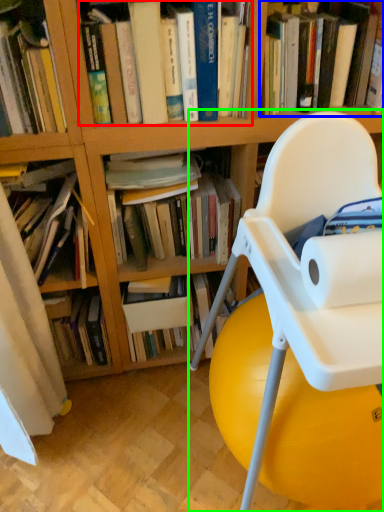
Question: Which object is positioned farthest from book (highlighted by a red box)? Select from book (highlighted by a blue box) and chair (highlighted by a green box).

Choices:
 (A) book
 (B) chair

Answer: (B)